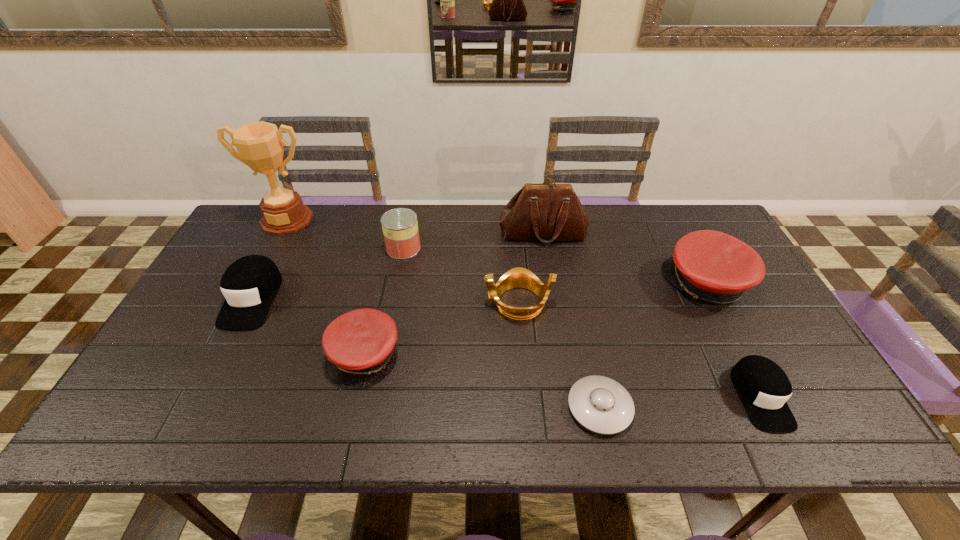
What are the coordinates of `blank area located on the front-facing side of the bigger red cap` in the screenshot? It's located at (587, 284).

At what (x,y) coordinates should I click in order to perform the action: click on free region located 0.390m at the front emblem of the tiara. Please return your answer as a coordinate pair (x, y). Looking at the image, I should click on (344, 302).

Where is `vacant space located 0.110m at the front emblem of the tiara`? vacant space located 0.110m at the front emblem of the tiara is located at coordinates (444, 302).

At what (x,y) coordinates should I click in order to perform the action: click on vacant space located at the front emblem of the tiara. Please return your answer as a coordinate pair (x, y). Looking at the image, I should click on (404, 302).

Locate an element on the screen. The height and width of the screenshot is (540, 960). vacant space located 0.230m on the front-facing side of the farther black cap is located at coordinates click(x=194, y=411).

This screenshot has height=540, width=960. Find the location of `free location located 0.310m on the left of the saucer`. free location located 0.310m on the left of the saucer is located at coordinates (431, 407).

Identify the location of award present at the far edge. (259, 144).

Find the location of a particular element. The height and width of the screenshot is (540, 960). shoulder bag positioned at the far edge is located at coordinates (546, 212).

The height and width of the screenshot is (540, 960). I want to click on can at the far edge, so click(x=400, y=227).

This screenshot has height=540, width=960. In order to click on cap present at the near edge in this screenshot , I will do `click(763, 386)`.